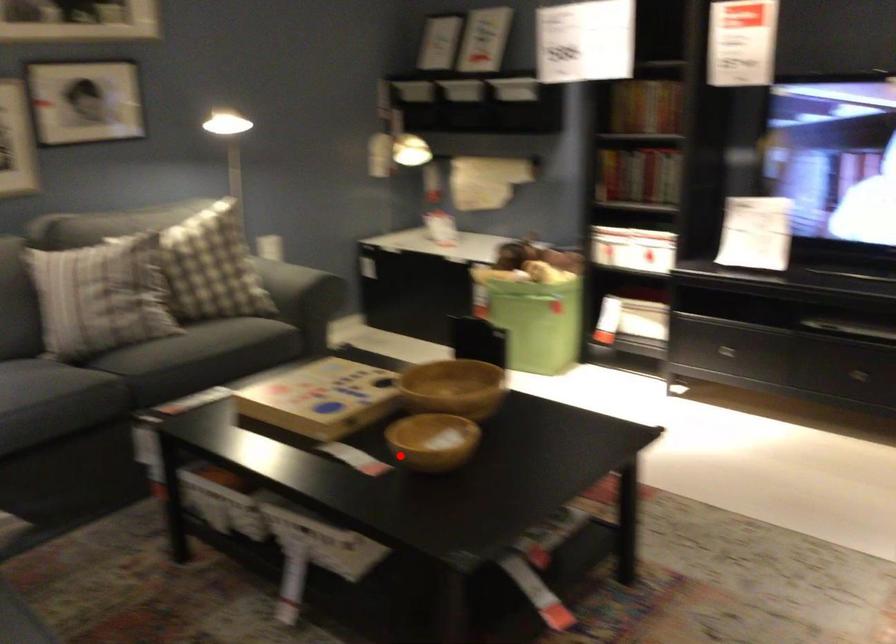
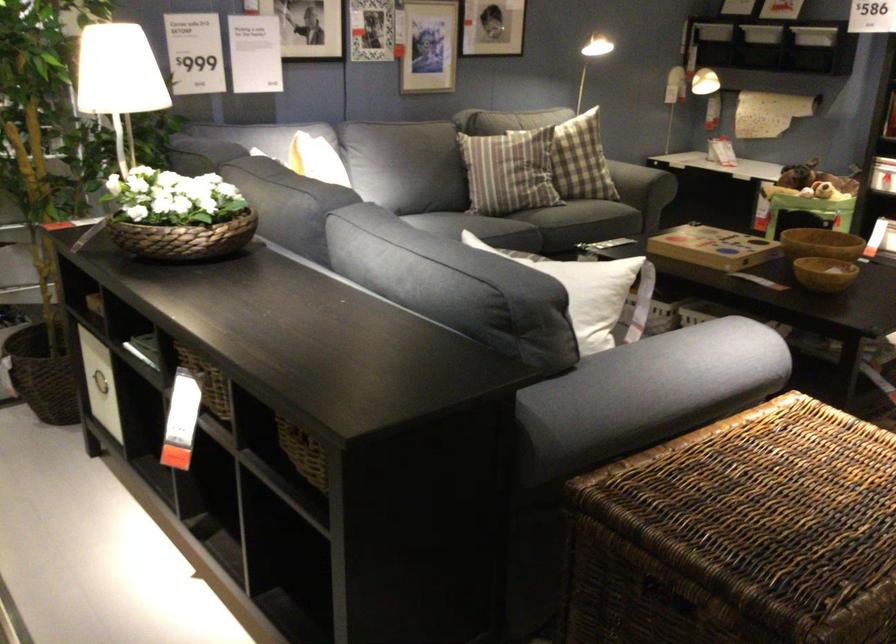
Where in the second image is the point corresponding to the highlighted location from the first image?

(823, 272)